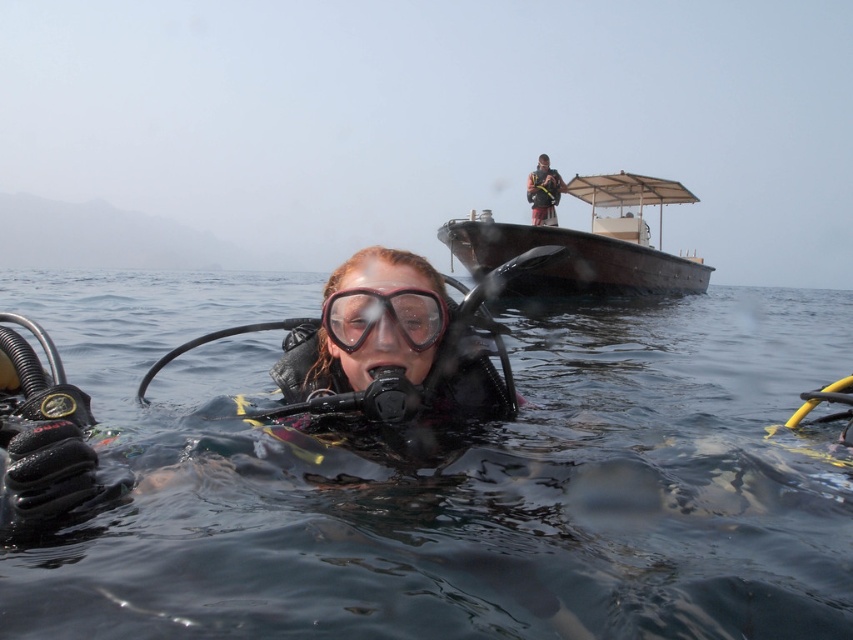
Can you confirm if transparent water at center is positioned above dark blue fabric at upper center?

No.

The width and height of the screenshot is (853, 640). Identify the location of transparent water at center. (451, 480).

Is point (10, 573) positioned after point (432, 308)?

No, it is not.

Can you confirm if transparent water at center is taller than transparent rubber goggles at center?

Correct, transparent water at center is much taller as transparent rubber goggles at center.

You are a GUI agent. You are given a task and a screenshot of the screen. Output one action in this format:
    pyautogui.click(x=<x>, y=<y>)
    Task: Click on the transparent water at center
    
    Given the screenshot: What is the action you would take?
    pyautogui.click(x=451, y=480)

Find the location of a particular element. Image resolution: width=853 pixels, height=640 pixels. transparent water at center is located at coordinates (451, 480).

Between transparent water at center and wooden boat at upper center, which one is positioned lower?

transparent water at center is lower down.

Who is more distant from viewer, (x=444, y=470) or (x=598, y=243)?

The point (x=598, y=243) is behind.

Locate an element on the screen. This screenshot has height=640, width=853. transparent water at center is located at coordinates (451, 480).

The height and width of the screenshot is (640, 853). What are the coordinates of `transparent water at center` in the screenshot? It's located at (451, 480).